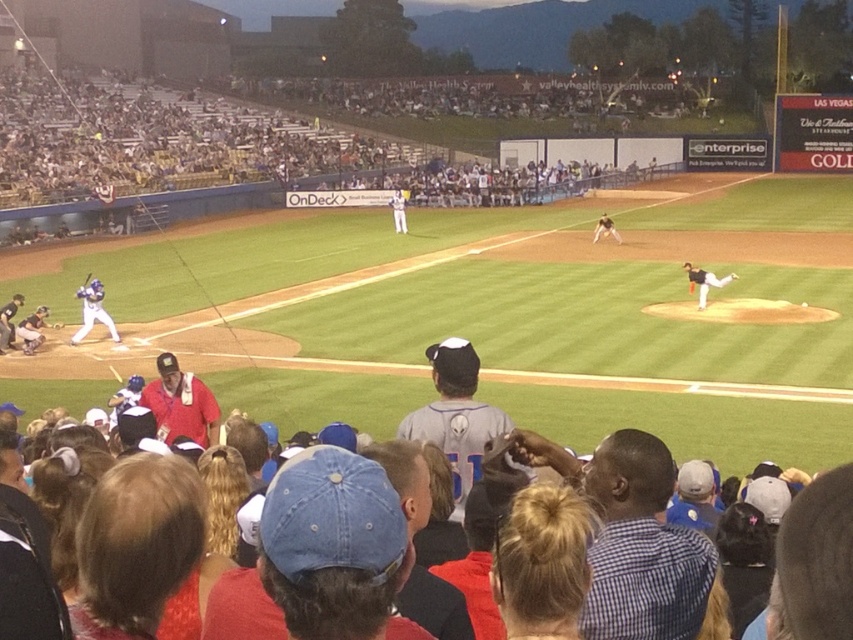
Question: Among these points, which one is farthest from the camera?

Choices:
 (A) (404, 214)
 (B) (596, 225)
 (C) (113, 332)

Answer: (A)

Question: Is matte blue uniform at left wider than black matte baseball pitcher at center?

Choices:
 (A) yes
 (B) no

Answer: (A)

Question: Where is black matte baseball pitcher at center located in relation to wooden bat at left in the image?

Choices:
 (A) below
 (B) above

Answer: (A)

Question: Is black matte baseball pitcher at center positioned in front of dark brown leather glove at center?

Choices:
 (A) no
 (B) yes

Answer: (B)

Question: Among these points, which one is nearest to the camera?

Choices:
 (A) (683, 264)
 (B) (607, 216)
 (C) (90, 282)
 (D) (392, 209)

Answer: (C)

Question: Which is nearer to the black matte baseball pitcher at center?

Choices:
 (A) white uniform at center
 (B) dark brown leather glove at center
 (C) matte blue uniform at left

Answer: (B)